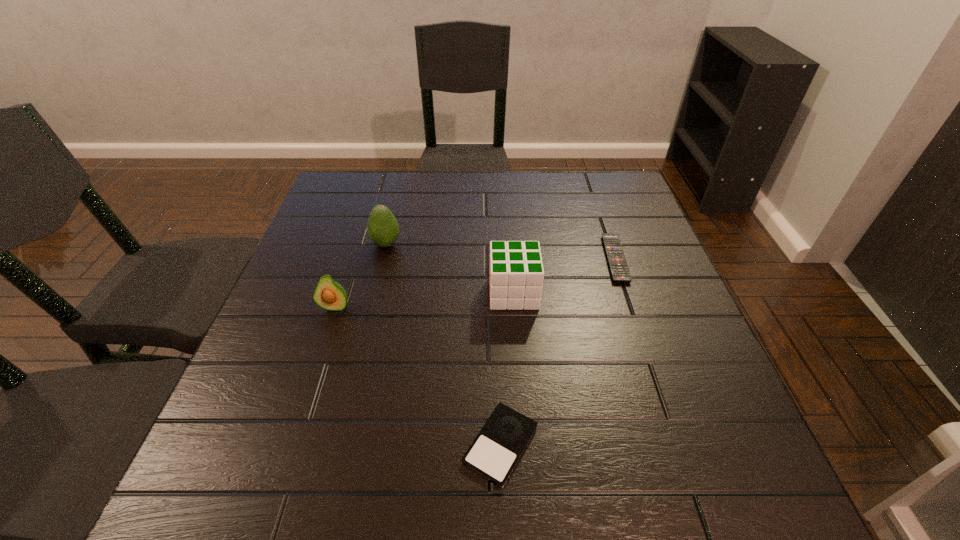
Find the location of a particular element. vacant space located 0.350m on the red face of the cube is located at coordinates (338, 293).

Locate an element on the screen. This screenshot has width=960, height=540. blank space located on the cut side of the nearer avocado is located at coordinates (283, 463).

Image resolution: width=960 pixels, height=540 pixels. I want to click on vacant region located on the front of the remote control, so click(x=642, y=338).

Locate an element on the screen. The width and height of the screenshot is (960, 540). vacant area situated on the back of the nearest object is located at coordinates (496, 334).

Identify the location of object that is at the near edge. (494, 453).

Locate an element on the screen. object that is positioned at the left edge is located at coordinates (329, 294).

What are the coordinates of `object located at the right edge` in the screenshot? It's located at tap(619, 269).

Where is `free space at the far edge of the desktop`? free space at the far edge of the desktop is located at coordinates (570, 179).

I want to click on vacant space at the near edge of the desktop, so click(x=432, y=472).

In the image, there is a desktop. What are the coordinates of `free space at the left edge` in the screenshot? It's located at 264,362.